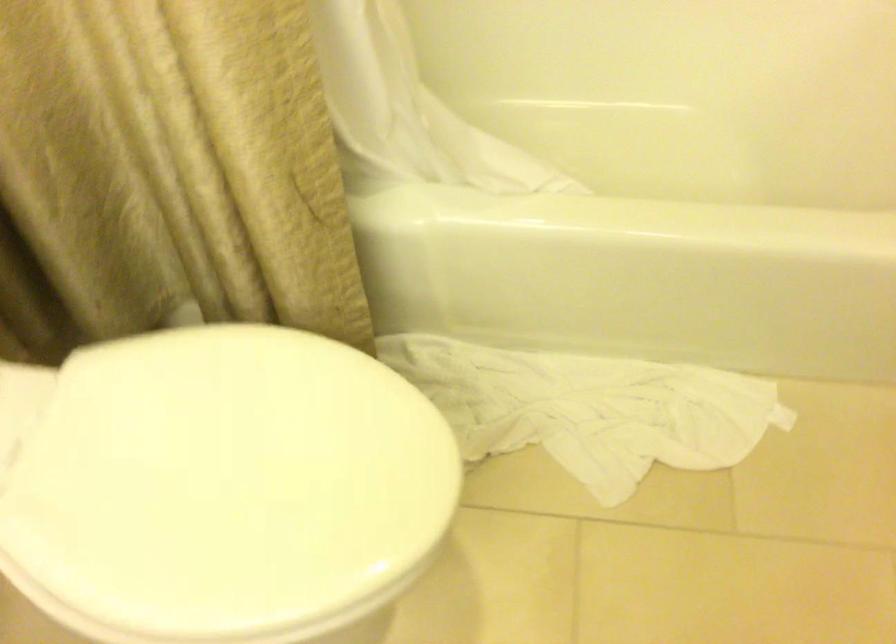
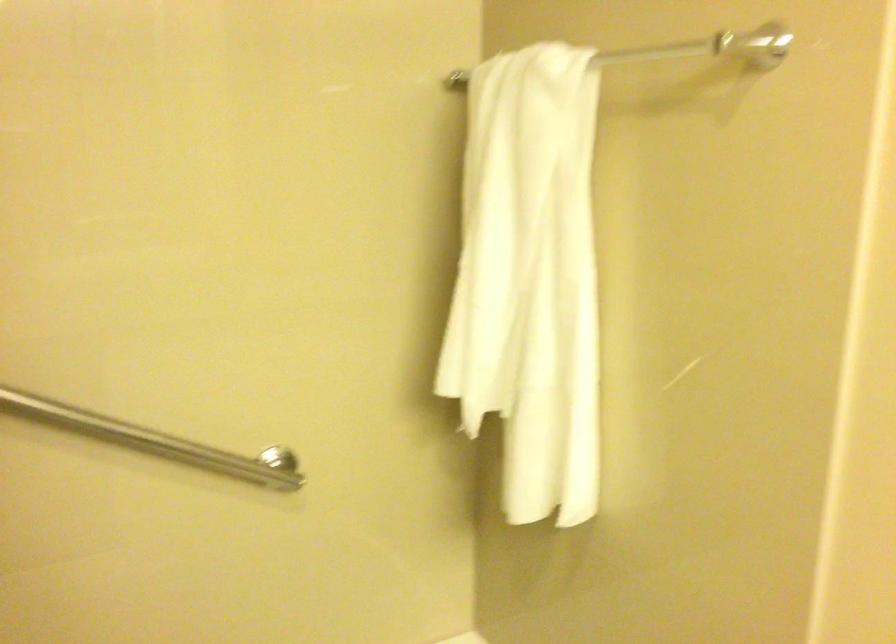
The images are taken continuously from a first-person perspective. In which direction is your viewpoint rotating?

The camera's rotation is toward right-up.